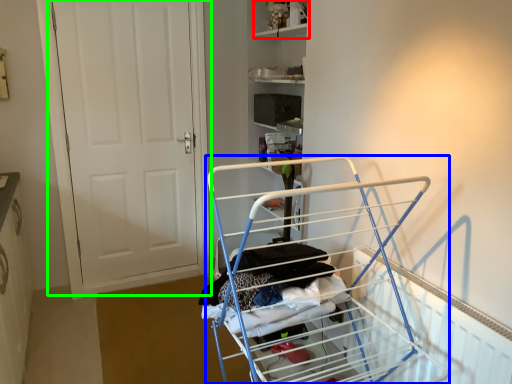
Question: Which object is the farthest from shelf (highlighted by a red box)? Choose among these: furniture (highlighted by a blue box) or door (highlighted by a green box).

Choices:
 (A) furniture
 (B) door

Answer: (A)